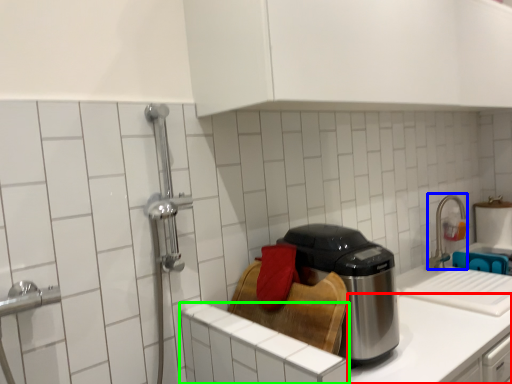
Question: Based on their relative distances, which object is farther from counter top (highlighted by a red box)? Choose from faucet (highlighted by a blue box) and cabinetry (highlighted by a green box).

Choices:
 (A) faucet
 (B) cabinetry

Answer: (A)